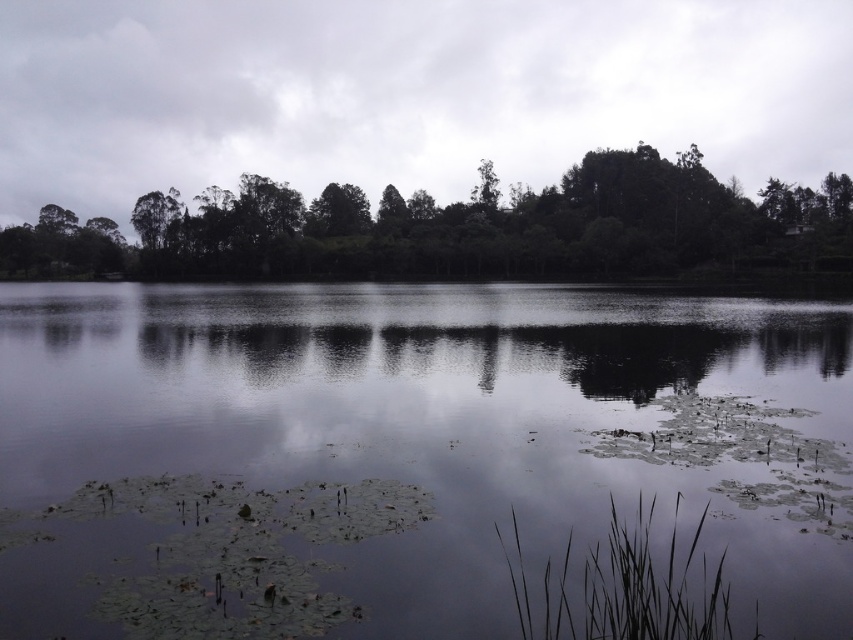
Question: Is transparent water at center closer to the viewer compared to green leafy trees at upper center?

Choices:
 (A) yes
 (B) no

Answer: (A)

Question: Can you confirm if transparent water at center is thinner than green leafy trees at upper center?

Choices:
 (A) no
 (B) yes

Answer: (B)

Question: Which of the following is the farthest from the observer?

Choices:
 (A) green leafy trees at upper center
 (B) transparent water at center

Answer: (A)

Question: Which point is farther from the camera taking this photo?

Choices:
 (A) (624, 269)
 (B) (190, 369)

Answer: (A)

Question: Can you confirm if transparent water at center is wider than green leafy trees at upper center?

Choices:
 (A) yes
 (B) no

Answer: (B)